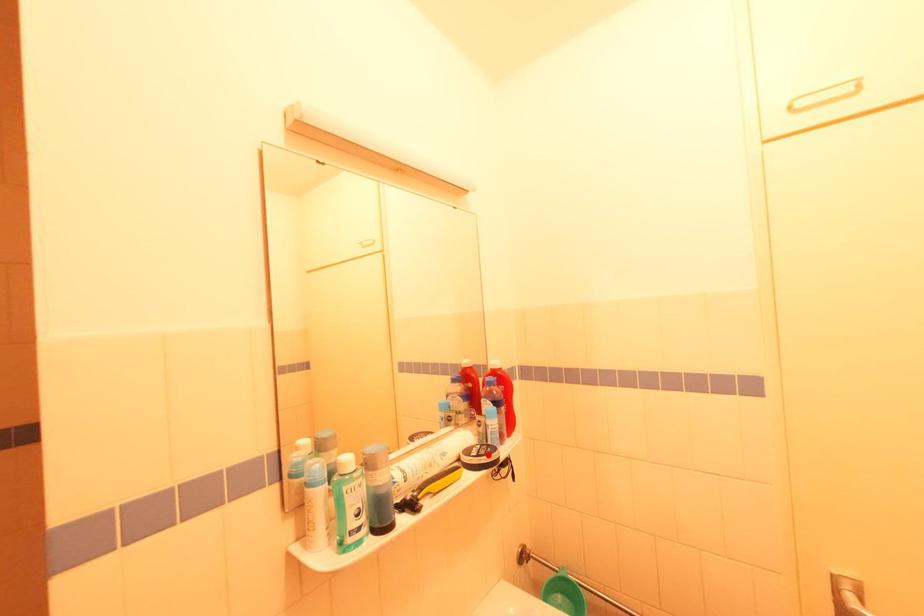
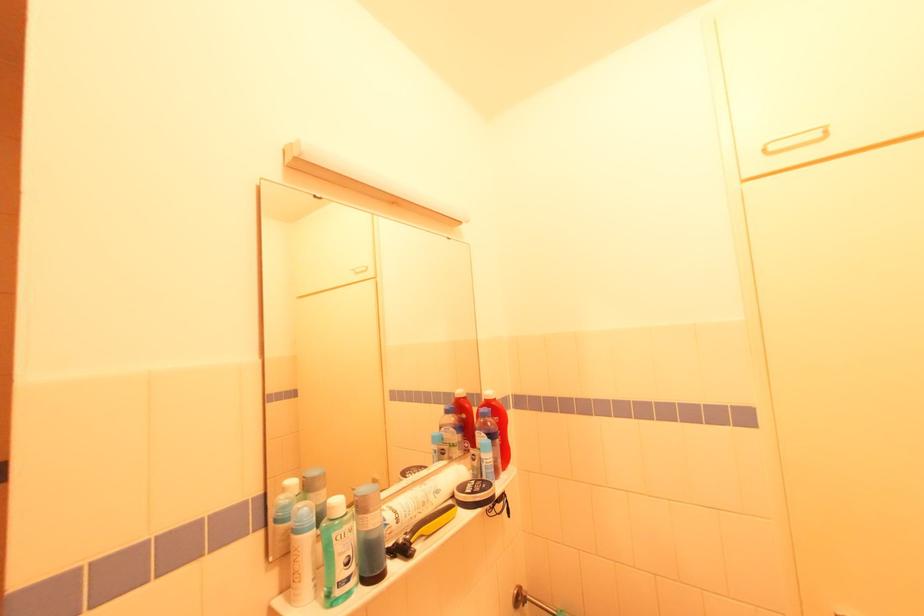
Where in the second image is the point corresponding to the highlighted location from the first image?

(482, 492)